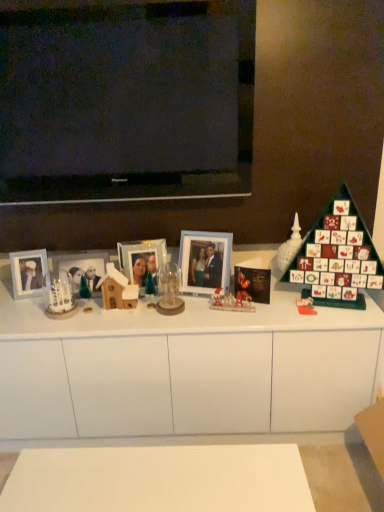
The width and height of the screenshot is (384, 512). Identify the location of vacant space in front of clear glass ornament at center, positioned as the fourth toy in right-to-left order. (170, 320).